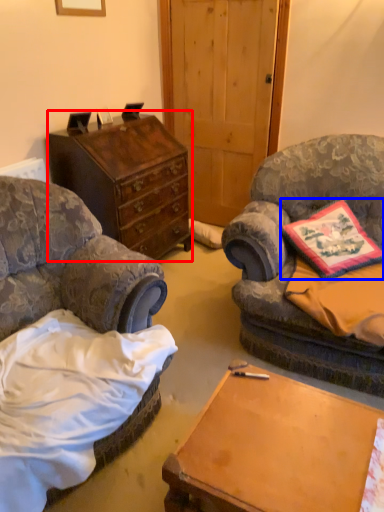
Question: Among these objects, which one is farthest to the camera, chest of drawers (highlighted by a red box) or pillow (highlighted by a blue box)?

Choices:
 (A) chest of drawers
 (B) pillow

Answer: (A)